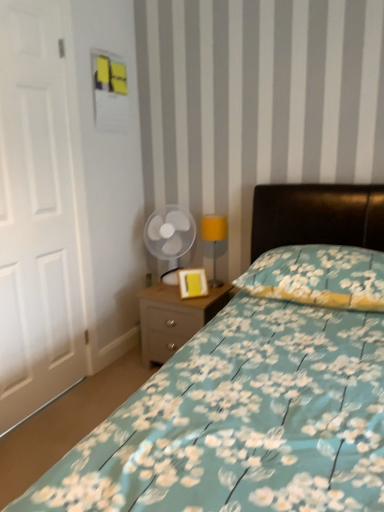
Describe the element at coordinates (36, 216) in the screenshot. I see `white matte door at left` at that location.

At what (x,y) coordinates should I click in order to perform the action: click on floral fabric bed at center. Please return your answer as a coordinate pair (x, y). Looking at the image, I should click on (316, 215).

Describe the element at coordinates (316, 215) in the screenshot. This screenshot has height=512, width=384. I see `floral fabric bed at center` at that location.

Locate an element on the screen. The height and width of the screenshot is (512, 384). transparent plastic fan at center is located at coordinates (170, 234).

Does point (318, 258) appear closer or farther from the camera than point (225, 221)?

Point (318, 258) is closer to the camera than point (225, 221).

Who is shorter, floral fabric pillow at center or yellow fabric lampshade at center?

With less height is floral fabric pillow at center.

Considering the relative sizes of floral fabric pillow at center and yellow fabric lampshade at center in the image provided, is floral fabric pillow at center smaller than yellow fabric lampshade at center?

No.

Is floral fabric pillow at center positioned far away from yellow fabric lampshade at center?

No.

From the picture: Is transparent plastic fan at center wider or thinner than floral fabric pillow at center?

Considering their sizes, transparent plastic fan at center looks slimmer than floral fabric pillow at center.

Relative to floral fabric pillow at center, is transparent plastic fan at center in front or behind?

In the image, transparent plastic fan at center appears behind floral fabric pillow at center.

From the image's perspective, which one is positioned lower, transparent plastic fan at center or floral fabric pillow at center?

floral fabric pillow at center.

Is transparent plastic fan at center surrounding floral fabric pillow at center?

No, floral fabric pillow at center is not a part of transparent plastic fan at center.

Is transparent plastic fan at center aimed at light wood/texture nightstand at lower center?

No, transparent plastic fan at center is not facing towards light wood/texture nightstand at lower center.

Find the location of a particular element. The width and height of the screenshot is (384, 512). nightstand below the transparent plastic fan at center (from the image's perspective) is located at coordinates (174, 318).

Could light wood/texture nightstand at lower center be considered to be inside transparent plastic fan at center?

No, transparent plastic fan at center does not contain light wood/texture nightstand at lower center.

Find the location of a particular element. The width and height of the screenshot is (384, 512). mechanical fan positioned vertically above the floral fabric pillow at center (from a real-world perspective) is located at coordinates (170, 234).

Considering the relative sizes of floral fabric pillow at center and transparent plastic fan at center in the image provided, is floral fabric pillow at center shorter than transparent plastic fan at center?

Yes, floral fabric pillow at center is shorter than transparent plastic fan at center.

Considering the sizes of objects floral fabric pillow at center and transparent plastic fan at center in the image provided, who is bigger, floral fabric pillow at center or transparent plastic fan at center?

floral fabric pillow at center.

Which of these two, light wood/texture nightstand at lower center or floral fabric bed at center, is smaller?

light wood/texture nightstand at lower center is smaller.

From the image's perspective, is light wood/texture nightstand at lower center above floral fabric bed at center?

No, from the image's perspective, light wood/texture nightstand at lower center is not above floral fabric bed at center.

Measure the distance from light wood/texture nightstand at lower center to floral fabric bed at center.

They are 15.94 inches apart.

How different are the orientations of light wood/texture nightstand at lower center and floral fabric bed at center in degrees?

light wood/texture nightstand at lower center and floral fabric bed at center are facing 3.47 degrees away from each other.

From the image's perspective, between white matte door at left and light wood/texture nightstand at lower center, who is located below?

From the image's view, light wood/texture nightstand at lower center is below.

From a real-world perspective, who is located lower, white matte door at left or light wood/texture nightstand at lower center?

light wood/texture nightstand at lower center, from a real-world perspective.

Which object is closer to the camera taking this photo, white matte door at left or light wood/texture nightstand at lower center?

white matte door at left is more forward.

Which of these two, floral fabric bed at center or transparent plastic fan at center, is thinner?

Thinner between the two is transparent plastic fan at center.

In terms of size, does floral fabric bed at center appear bigger or smaller than transparent plastic fan at center?

floral fabric bed at center is bigger than transparent plastic fan at center.

From a real-world perspective, does floral fabric bed at center sit lower than transparent plastic fan at center?

Actually, floral fabric bed at center is physically above transparent plastic fan at center in the real world.

Is floral fabric bed at center in front of or behind transparent plastic fan at center in the image?

Clearly, floral fabric bed at center is in front of transparent plastic fan at center.

You are a GUI agent. You are given a task and a screenshot of the screen. Output one action in this format:
    pyautogui.click(x=<x>, y=<y>)
    Task: Click on the table lamp that is under the floral fabric pillow at center (from a real-world perspective)
    This screenshot has width=384, height=512.
    Given the screenshot: What is the action you would take?
    pyautogui.click(x=214, y=238)

The width and height of the screenshot is (384, 512). I want to click on pillow in front of the transparent plastic fan at center, so (319, 276).

From the image, which object appears to be nearer to floral fabric pillow at center, yellow fabric lampshade at center or yellow matte picture frame at center?

yellow matte picture frame at center is closer to floral fabric pillow at center.

Based on their spatial positions, is floral fabric pillow at center or white matte door at left closer to floral fabric bed at center?

white matte door at left is positioned closer to the anchor floral fabric bed at center.

Which object lies nearer to the anchor point white matte door at left, floral fabric bed at center or yellow fabric lampshade at center?

floral fabric bed at center is positioned closer to the anchor white matte door at left.

Based on their spatial positions, is light wood/texture nightstand at lower center or yellow matte picture frame at center closer to yellow fabric lampshade at center?

Among the two, yellow matte picture frame at center is located nearer to yellow fabric lampshade at center.

When comparing their distances from white matte door at left, does yellow fabric lampshade at center or light wood/texture nightstand at lower center seem further?

yellow fabric lampshade at center is positioned further to the anchor white matte door at left.

Based on their spatial positions, is yellow fabric lampshade at center or yellow matte picture frame at center further from floral fabric bed at center?

Among the two, yellow fabric lampshade at center is located further to floral fabric bed at center.

From the image, which object appears to be farther from floral fabric pillow at center, floral fabric bed at center or yellow matte picture frame at center?

floral fabric bed at center is further to floral fabric pillow at center.

Which object lies further to the anchor point transparent plastic fan at center, yellow matte picture frame at center or light wood/texture nightstand at lower center?

Based on the image, light wood/texture nightstand at lower center appears to be further to transparent plastic fan at center.

The width and height of the screenshot is (384, 512). I want to click on picture frame between floral fabric pillow at center and transparent plastic fan at center along the z-axis, so coord(192,283).

At what (x,y) coordinates should I click in order to perform the action: click on nightstand between floral fabric pillow at center and transparent plastic fan at center from front to back. Please return your answer as a coordinate pair (x, y). The width and height of the screenshot is (384, 512). Looking at the image, I should click on (174, 318).

Find the location of a particular element. pillow located between floral fabric bed at center and transparent plastic fan at center in the depth direction is located at coordinates (319, 276).

This screenshot has height=512, width=384. I want to click on nightstand located between white matte door at left and yellow matte picture frame at center in the depth direction, so click(x=174, y=318).